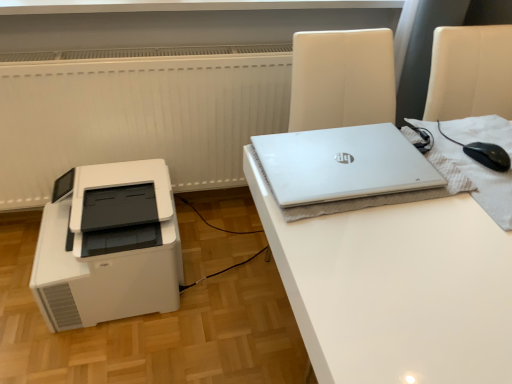
Locate an element on the screen. free spot to the left of black matte mouse at right is located at coordinates (418, 165).